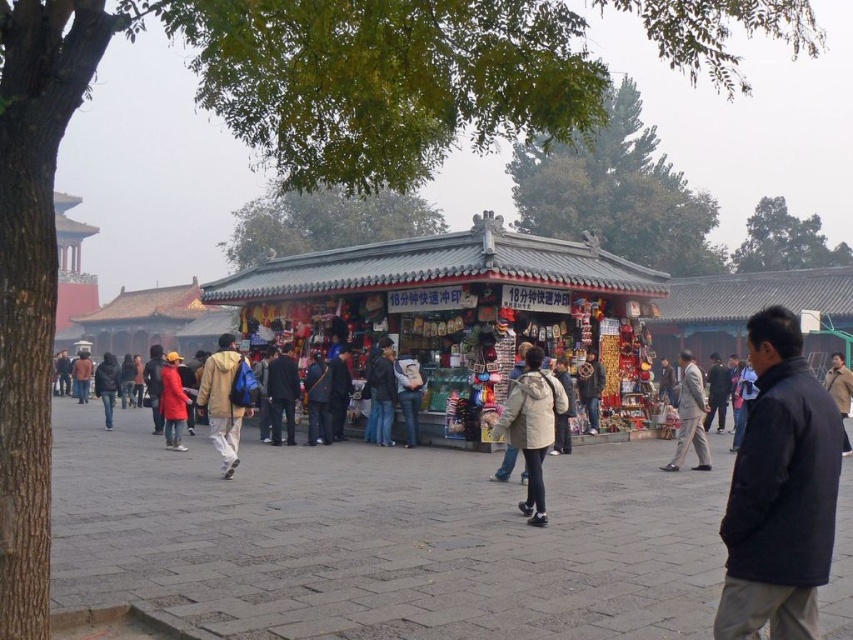
Question: Observing the image, what is the correct spatial positioning of black matte jacket at lower right in reference to dark blue jeans at center?

Choices:
 (A) above
 (B) below

Answer: (A)

Question: Which point is farther from the camera taking this photo?

Choices:
 (A) (827, 561)
 (B) (537, 412)

Answer: (B)

Question: Does light beige jacket at center appear over red matte coat at center?

Choices:
 (A) no
 (B) yes

Answer: (B)

Question: Which object appears closest to the camera in this image?

Choices:
 (A) denim jacket at center
 (B) dark blue jeans at center
 (C) dark blue jacket at center
 (D) light brown fabric jacket at center

Answer: (D)

Question: Considering the real-world distances, which object is closest to the denim jacket at center?

Choices:
 (A) red matte coat at center
 (B) light beige jacket at center

Answer: (A)

Question: Can you confirm if light brown suit at center is positioned to the right of dark blue jacket at center?

Choices:
 (A) no
 (B) yes

Answer: (B)